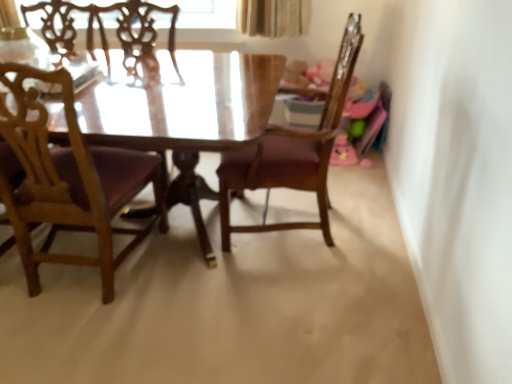
Question: Does wooden chair at left, the 2th chair positioned from the right, have a smaller size compared to wooden chair at center, the second chair when ordered from left to right?

Choices:
 (A) yes
 (B) no

Answer: (A)

Question: Does wooden chair at left, the 2th chair positioned from the right, have a lesser width compared to wooden chair at center, which is the 1th chair in right-to-left order?

Choices:
 (A) no
 (B) yes

Answer: (A)

Question: From a real-world perspective, is wooden chair at left, the 1th chair from the left, on top of wooden chair at center, the second chair when ordered from left to right?

Choices:
 (A) no
 (B) yes

Answer: (A)

Question: From the image's perspective, would you say wooden chair at left, the 2th chair positioned from the right, is shown under wooden chair at center, the second chair when ordered from left to right?

Choices:
 (A) yes
 (B) no

Answer: (A)

Question: Is wooden chair at left, the 2th chair positioned from the right, next to wooden chair at center, the second chair when ordered from left to right?

Choices:
 (A) yes
 (B) no

Answer: (B)

Question: Is wooden chair at left, the 2th chair positioned from the right, aimed at wooden chair at center, the second chair when ordered from left to right?

Choices:
 (A) no
 (B) yes

Answer: (A)

Question: Is wooden chair at left, the 1th chair from the left, inside wooden chair at center, the second chair when ordered from left to right?

Choices:
 (A) no
 (B) yes

Answer: (A)

Question: Is wooden chair at center, the second chair when ordered from left to right, at the left side of wooden chair at left, the 2th chair positioned from the right?

Choices:
 (A) yes
 (B) no

Answer: (B)

Question: Is wooden chair at center, which is the 1th chair in right-to-left order, not near wooden chair at left, the 2th chair positioned from the right?

Choices:
 (A) yes
 (B) no

Answer: (B)

Question: From the image's perspective, is wooden chair at center, which is the 1th chair in right-to-left order, located above wooden chair at left, the 2th chair positioned from the right?

Choices:
 (A) no
 (B) yes

Answer: (B)

Question: From a real-world perspective, is wooden chair at center, which is the 1th chair in right-to-left order, under wooden chair at left, the 2th chair positioned from the right?

Choices:
 (A) no
 (B) yes

Answer: (A)

Question: Is wooden chair at center, the second chair when ordered from left to right, outside wooden chair at left, the 1th chair from the left?

Choices:
 (A) yes
 (B) no

Answer: (A)

Question: From the image's perspective, relative to wooden chair at center, which is the 1th chair in right-to-left order, is wooden chair at left, the 1th chair from the left, above or below?

Choices:
 (A) below
 (B) above

Answer: (A)